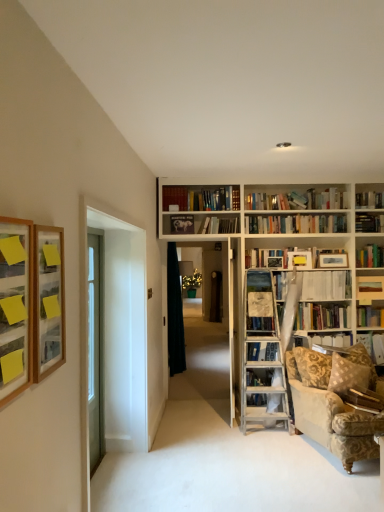
Question: Does clear glass door at left have a larger size compared to hardcover book at right, which is counted as the 2th book, starting from the bottom?

Choices:
 (A) no
 (B) yes

Answer: (B)

Question: Could you tell me if clear glass door at left is facing hardcover book at right, acting as the third book starting from the front?

Choices:
 (A) no
 (B) yes

Answer: (A)

Question: Can hardcover book at right, acting as the third book starting from the front, be found inside clear glass door at left?

Choices:
 (A) no
 (B) yes

Answer: (A)

Question: Is clear glass door at left in front of hardcover book at right, marked as the 4th book in a top-to-bottom arrangement?

Choices:
 (A) yes
 (B) no

Answer: (A)

Question: Would you say clear glass door at left is outside hardcover book at right, acting as the third book starting from the front?

Choices:
 (A) no
 (B) yes

Answer: (B)

Question: Considering the positions of hardcover book at right, placed as the fifth book when sorted from left to right, and black fabric curtain at center in the image, is hardcover book at right, placed as the fifth book when sorted from left to right, wider or thinner than black fabric curtain at center?

Choices:
 (A) thin
 (B) wide

Answer: (A)

Question: Would you say hardcover book at right, marked as the 4th book in a top-to-bottom arrangement, is to the left or to the right of black fabric curtain at center in the picture?

Choices:
 (A) left
 (B) right

Answer: (B)

Question: Is hardcover book at right, marked as the 4th book in a top-to-bottom arrangement, taller or shorter than black fabric curtain at center?

Choices:
 (A) tall
 (B) short

Answer: (B)

Question: Choose the correct answer: Is hardcover book at right, marked as the 4th book in a top-to-bottom arrangement, inside black fabric curtain at center or outside it?

Choices:
 (A) outside
 (B) inside

Answer: (A)

Question: Is wooden bookshelf at center wider or thinner than hardcover book at upper center, arranged as the first book when viewed from the top?

Choices:
 (A) wide
 (B) thin

Answer: (B)

Question: Visually, is wooden bookshelf at center positioned to the left or to the right of hardcover book at upper center, which is the 5th book in front-to-back order?

Choices:
 (A) right
 (B) left

Answer: (B)

Question: In terms of size, does wooden bookshelf at center appear bigger or smaller than hardcover book at upper center, which is counted as the fifth book, starting from the right?

Choices:
 (A) small
 (B) big

Answer: (B)

Question: From a real-world perspective, is wooden bookshelf at center physically located above or below hardcover book at upper center, which is the 5th book in front-to-back order?

Choices:
 (A) above
 (B) below

Answer: (B)

Question: Considering the positions of wooden picture frame at left, which ranks as the first picture frame in front-to-back order, and hardcover book at right, which is the first book from right to left, in the image, is wooden picture frame at left, which ranks as the first picture frame in front-to-back order, taller or shorter than hardcover book at right, which is the first book from right to left,?

Choices:
 (A) tall
 (B) short

Answer: (A)

Question: Would you say wooden picture frame at left, placed as the third picture frame when sorted from back to front, is to the left or to the right of hardcover book at right, which is counted as the 2th book, starting from the bottom, in the picture?

Choices:
 (A) right
 (B) left

Answer: (B)